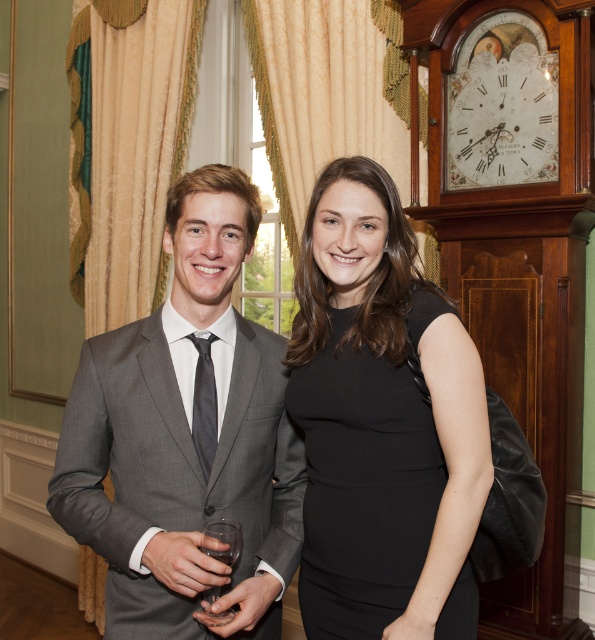
You are a photographer at the event and want to capture a shot of the black satin tie at center and the clear glass wine glass at center. Which object is positioned higher in the frame?

The black satin tie at center is located above the clear glass wine glass at center, so it is positioned higher in the frame.

You are a photographer adjusting your camera settings to capture the scene. You need to focus on the two points in the image labeled as point (277, 394) and point (468, 106). Which point should you prioritize focusing on first to ensure the closest subject is sharp?

Point (277, 394) should be prioritized for focusing first because it is closer to the camera than point (468, 106), ensuring the closest subject is sharp.